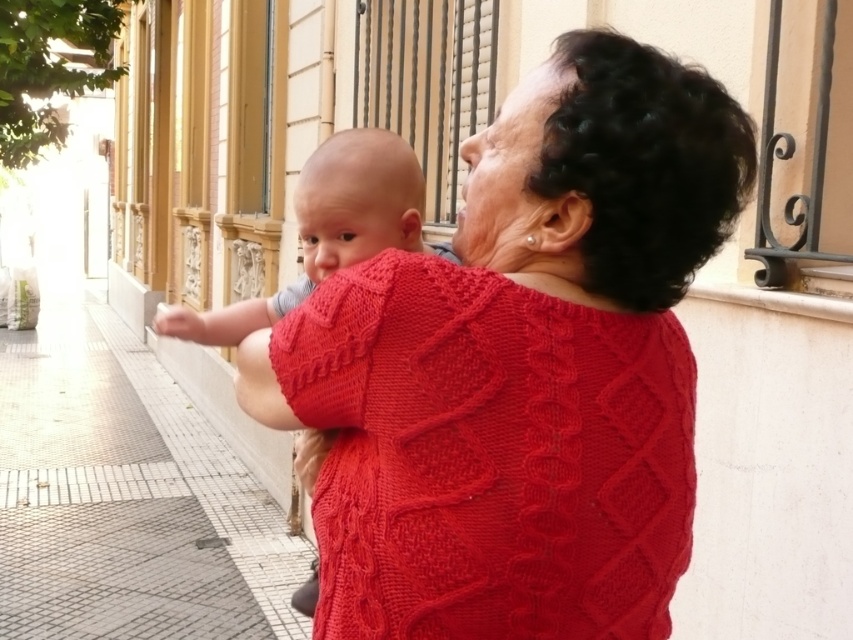
Question: Which point is closer to the camera taking this photo?

Choices:
 (A) (621, 340)
 (B) (260, 323)
 (C) (78, 449)

Answer: (A)

Question: Among these points, which one is farthest from the camera?

Choices:
 (A) (318, 156)
 (B) (24, 586)
 (C) (538, 243)

Answer: (B)

Question: Observing the image, what is the correct spatial positioning of gray mosaic pavement at lower left in reference to smooth skin baby at center?

Choices:
 (A) left
 (B) right

Answer: (A)

Question: Is gray mosaic pavement at lower left below smooth skin baby at center?

Choices:
 (A) no
 (B) yes

Answer: (B)

Question: Among these objects, which one is nearest to the camera?

Choices:
 (A) gray mosaic pavement at lower left
 (B) smooth skin baby at center
 (C) cable-knit sweater at center

Answer: (C)

Question: Is cable-knit sweater at center to the right of smooth skin baby at center from the viewer's perspective?

Choices:
 (A) no
 (B) yes

Answer: (B)